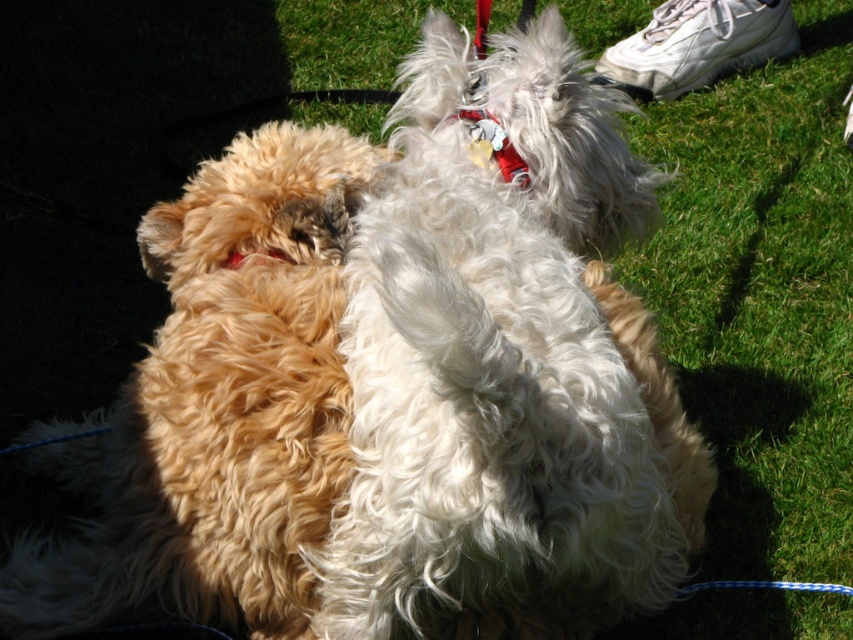
Question: Estimate the real-world distances between objects in this image. Which object is farther from the red fabric neckband at center?

Choices:
 (A) fluffy golden fur at center
 (B) red fabric collar at center
 (C) green grass at center

Answer: (C)

Question: Can you confirm if green grass at center is wider than red fabric neckband at center?

Choices:
 (A) no
 (B) yes

Answer: (B)

Question: Which object is closer to the camera taking this photo?

Choices:
 (A) red fabric collar at center
 (B) red fabric neckband at center

Answer: (A)

Question: Does fluffy golden fur at center appear on the left side of red fabric collar at center?

Choices:
 (A) yes
 (B) no

Answer: (A)

Question: Observing the image, what is the correct spatial positioning of fluffy golden fur at center in reference to red fabric neckband at center?

Choices:
 (A) above
 (B) below

Answer: (B)

Question: Which of the following is the closest to the observer?

Choices:
 (A) green grass at center
 (B) red fabric neckband at center
 (C) red fabric collar at center
 (D) fluffy golden fur at center

Answer: (D)